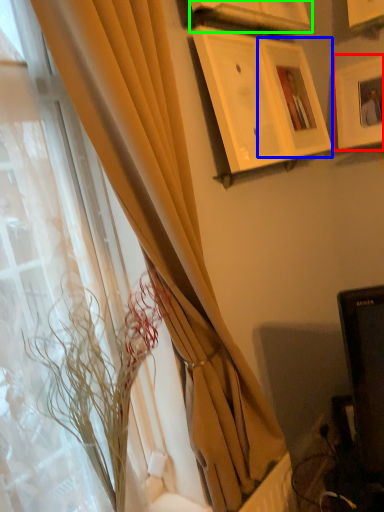
Question: Which object is positioned farthest from picture frame (highlighted by a red box)? Select from picture frame (highlighted by a blue box) and picture frame (highlighted by a green box).

Choices:
 (A) picture frame
 (B) picture frame

Answer: (B)